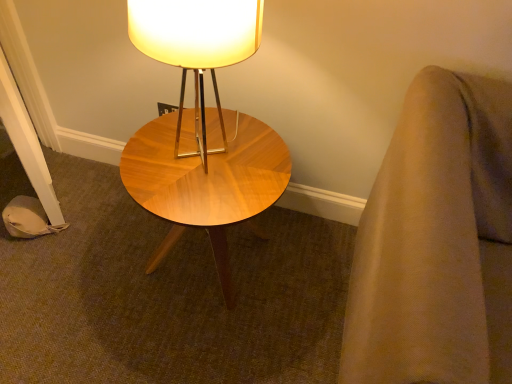
This screenshot has height=384, width=512. What are the coordinates of `free space to the left of woodenwoodencoffee table at center` in the screenshot? It's located at (82, 248).